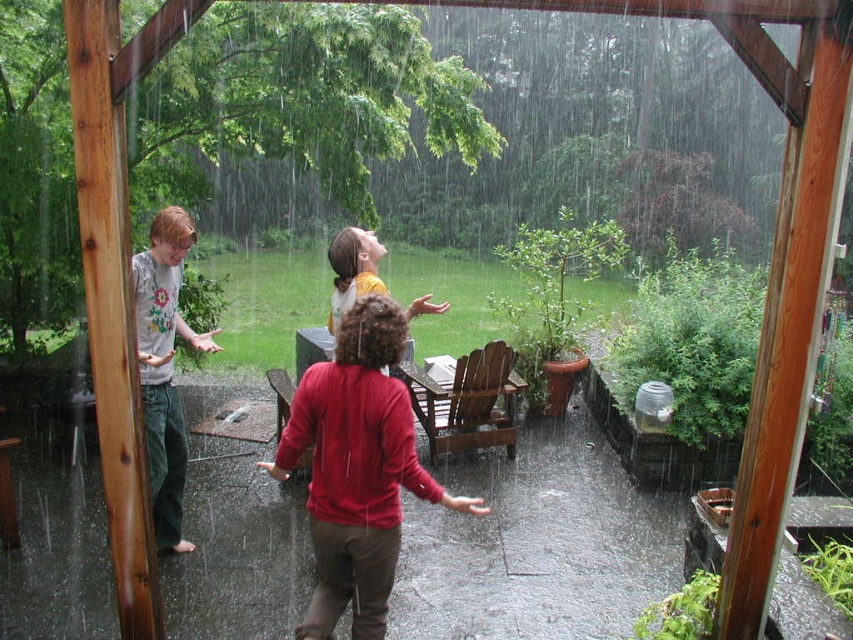
Can you confirm if matte red sweater at center is shorter than gray cotton shirt at left?

Indeed, matte red sweater at center has a lesser height compared to gray cotton shirt at left.

Is matte red sweater at center below gray cotton shirt at left?

Correct, matte red sweater at center is located below gray cotton shirt at left.

Is point (294, 636) closer to camera compared to point (190, 225)?

Yes, point (294, 636) is in front of point (190, 225).

Locate an element on the screen. The image size is (853, 640). matte red sweater at center is located at coordinates (357, 468).